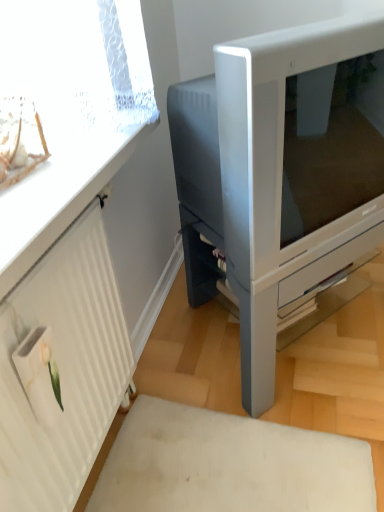
Question: From the image's perspective, is clear plastic window screen at upper left located above or below satin silver monitor at center?

Choices:
 (A) below
 (B) above

Answer: (B)

Question: Based on their sizes in the image, would you say clear plastic window screen at upper left is bigger or smaller than satin silver monitor at center?

Choices:
 (A) big
 (B) small

Answer: (B)

Question: Estimate the real-world distances between objects in this image. Which object is closer to the satin silver monitor at center?

Choices:
 (A) white textured radiator at left
 (B) clear plastic window screen at upper left

Answer: (B)

Question: Based on their relative distances, which object is nearer to the satin silver monitor at center?

Choices:
 (A) clear plastic window screen at upper left
 (B) white textured radiator at left

Answer: (A)